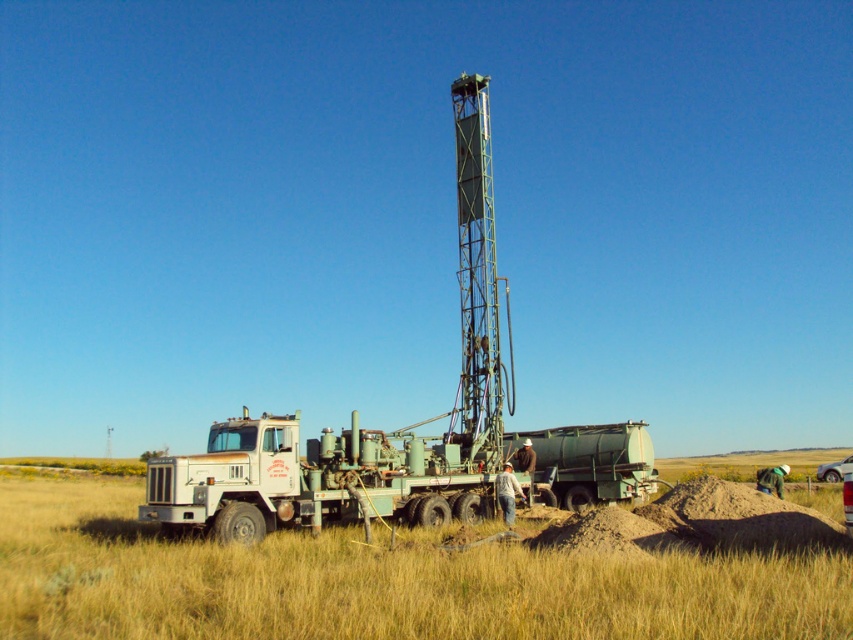
Question: Which point is closer to the camera taking this photo?

Choices:
 (A) (38, 593)
 (B) (438, 468)

Answer: (A)

Question: Which point is closer to the camera?

Choices:
 (A) yellow grass at lower center
 (B) white matte truck at center

Answer: (A)

Question: In this image, where is yellow grass at lower center located relative to white matte truck at center?

Choices:
 (A) right
 (B) left

Answer: (B)

Question: Can you confirm if yellow grass at lower center is positioned to the left of white matte truck at center?

Choices:
 (A) no
 (B) yes

Answer: (B)

Question: Which of the following is the closest to the observer?

Choices:
 (A) (322, 508)
 (B) (1, 573)

Answer: (B)

Question: Does yellow grass at lower center appear under white matte truck at center?

Choices:
 (A) no
 (B) yes

Answer: (B)